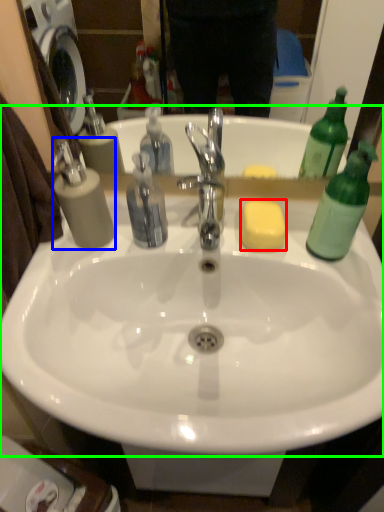
Question: Which object is positioned farthest from soap (highlighted by a red box)? Select from soap dispenser (highlighted by a blue box) and sink (highlighted by a green box).

Choices:
 (A) soap dispenser
 (B) sink

Answer: (A)